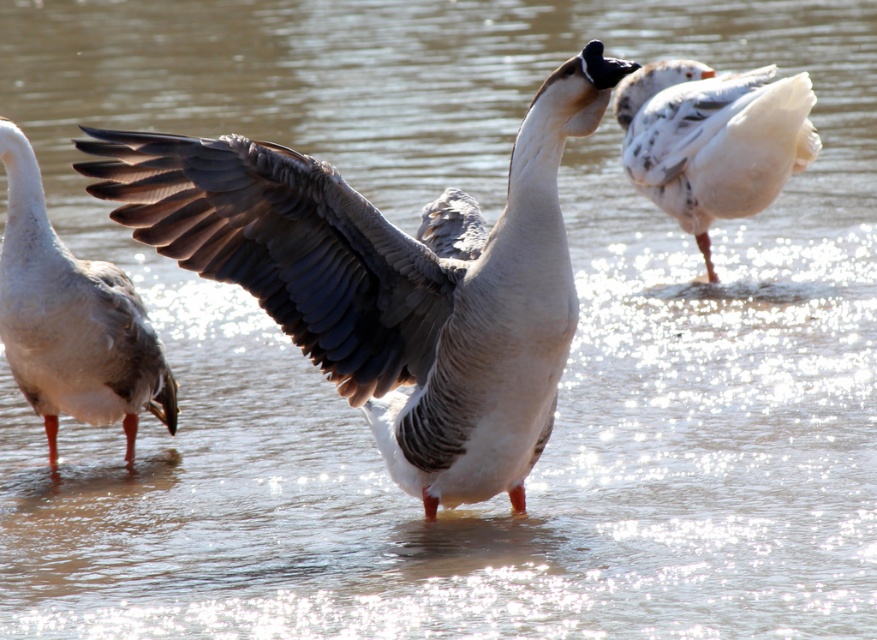
You are a birdwatcher observing the gray feathered goose at center and the white matte duck at left. Which one do you think is bigger in size?

The gray feathered goose at center is larger in size compared to the white matte duck at left.